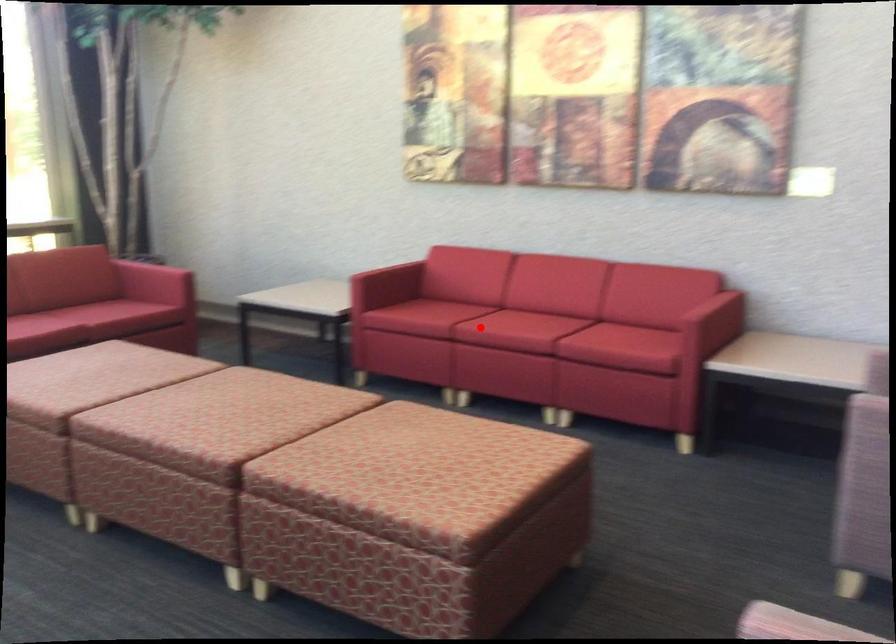
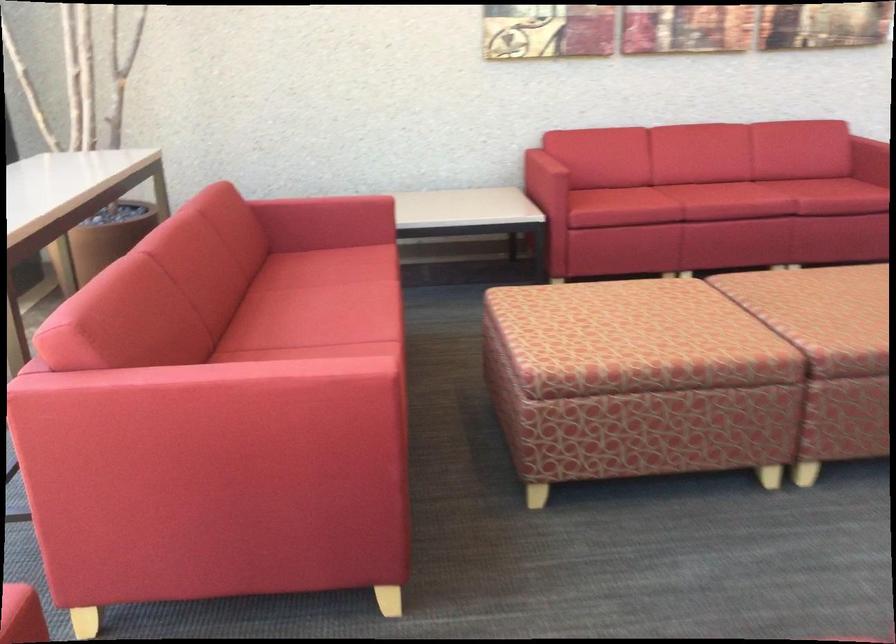
Find the pixel in the second image that matches the highlighted location in the first image.

(725, 201)